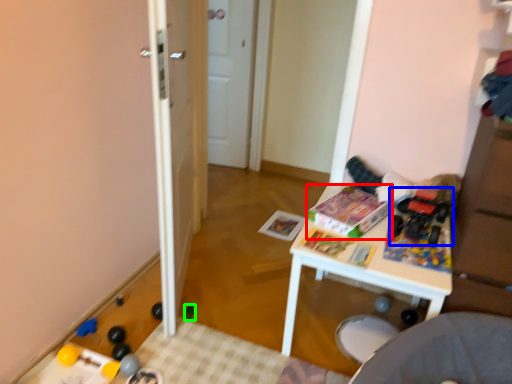
Question: Considering the real-world distances, which object is farthest from magazine (highlighted by a red box)? toy (highlighted by a blue box) or toy (highlighted by a green box)?

Choices:
 (A) toy
 (B) toy

Answer: (B)